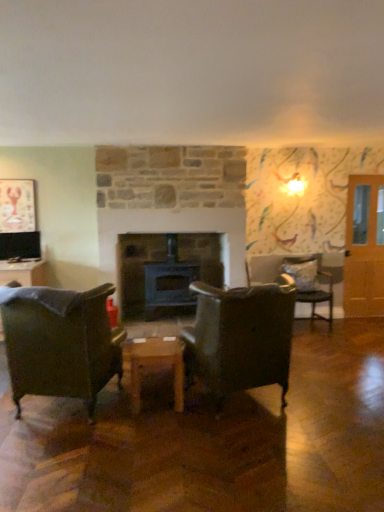
Question: Could you tell me if leather at center, the third chair in the back-to-front sequence, is turned towards black matte fireplace at center?

Choices:
 (A) no
 (B) yes

Answer: (B)

Question: Is leather at center, the third chair in the back-to-front sequence, to the right of black matte fireplace at center from the viewer's perspective?

Choices:
 (A) no
 (B) yes

Answer: (B)

Question: Is leather at center, which is the second chair from left to right, positioned behind black matte fireplace at center?

Choices:
 (A) no
 (B) yes

Answer: (A)

Question: From a real-world perspective, is leather at center, which is the second chair from left to right, positioned over black matte fireplace at center based on gravity?

Choices:
 (A) yes
 (B) no

Answer: (B)

Question: Is leather at center, which appears as the 1th chair when viewed from the front, shorter than black matte fireplace at center?

Choices:
 (A) no
 (B) yes

Answer: (B)

Question: Looking at the image, does leather at center, which is the second chair from left to right, seem bigger or smaller compared to wooden table at center?

Choices:
 (A) small
 (B) big

Answer: (B)

Question: Is point (220, 384) positioned closer to the camera than point (124, 366)?

Choices:
 (A) closer
 (B) farther

Answer: (A)

Question: Based on their positions, is leather at center, which appears as the 1th chair when viewed from the front, located to the left or right of wooden table at center?

Choices:
 (A) right
 (B) left

Answer: (A)

Question: Is leather at center, which appears as the 1th chair when viewed from the front, situated inside wooden table at center or outside?

Choices:
 (A) outside
 (B) inside

Answer: (A)

Question: Is velvet cushioned chair at right, which is the third chair from front to back, wider or thinner than black matte fireplace at center?

Choices:
 (A) wide
 (B) thin

Answer: (A)

Question: Is velvet cushioned chair at right, which is the third chair in left-to-right order, bigger or smaller than black matte fireplace at center?

Choices:
 (A) big
 (B) small

Answer: (B)

Question: Considering the positions of velvet cushioned chair at right, which ranks as the 1th chair in right-to-left order, and black matte fireplace at center in the image, is velvet cushioned chair at right, which ranks as the 1th chair in right-to-left order, taller or shorter than black matte fireplace at center?

Choices:
 (A) short
 (B) tall

Answer: (A)

Question: Considering the relative positions of velvet cushioned chair at right, the first chair when ordered from back to front, and black matte fireplace at center in the image provided, is velvet cushioned chair at right, the first chair when ordered from back to front, to the left or to the right of black matte fireplace at center?

Choices:
 (A) right
 (B) left

Answer: (A)

Question: In the image, is metallic lobster picture frame at upper left on the left side or the right side of translucent wooden door at right?

Choices:
 (A) left
 (B) right

Answer: (A)

Question: Choose the correct answer: Is metallic lobster picture frame at upper left inside translucent wooden door at right or outside it?

Choices:
 (A) inside
 (B) outside

Answer: (B)